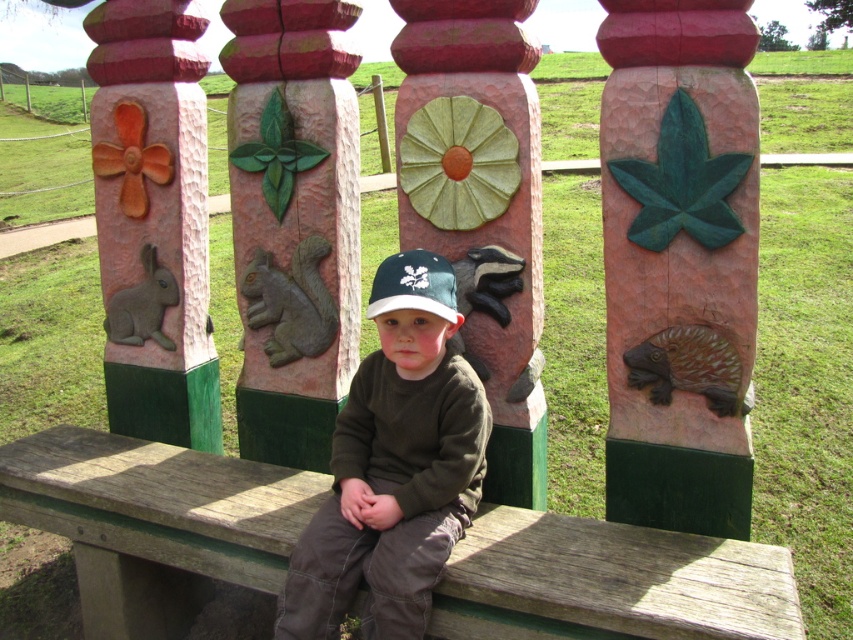
Which of these two, wooden bench at center or green stone squirrel at center, stands shorter?

Standing shorter between the two is wooden bench at center.

Who is more forward, (x=535, y=548) or (x=268, y=355)?

Positioned in front is point (x=535, y=548).

Find the location of `wooden bench at center`. wooden bench at center is located at coordinates (608, 582).

Does green matte leaf at upper right have a greater width compared to matte gray rabbit at left?

Yes, green matte leaf at upper right is wider than matte gray rabbit at left.

Is green matte leaf at upper right to the right of matte gray rabbit at left from the viewer's perspective?

Yes, green matte leaf at upper right is to the right of matte gray rabbit at left.

The height and width of the screenshot is (640, 853). What do you see at coordinates (679, 260) in the screenshot?
I see `green matte leaf at upper right` at bounding box center [679, 260].

Identify the location of green matte leaf at upper right. The width and height of the screenshot is (853, 640). (679, 260).

Is wooden bench at center taller than brown matte hedgehog at center?

Yes, wooden bench at center is taller than brown matte hedgehog at center.

Who is more forward, [260,492] or [518,388]?

Positioned in front is point [518,388].

The image size is (853, 640). In order to click on wooden bench at center in this screenshot , I will do `click(608, 582)`.